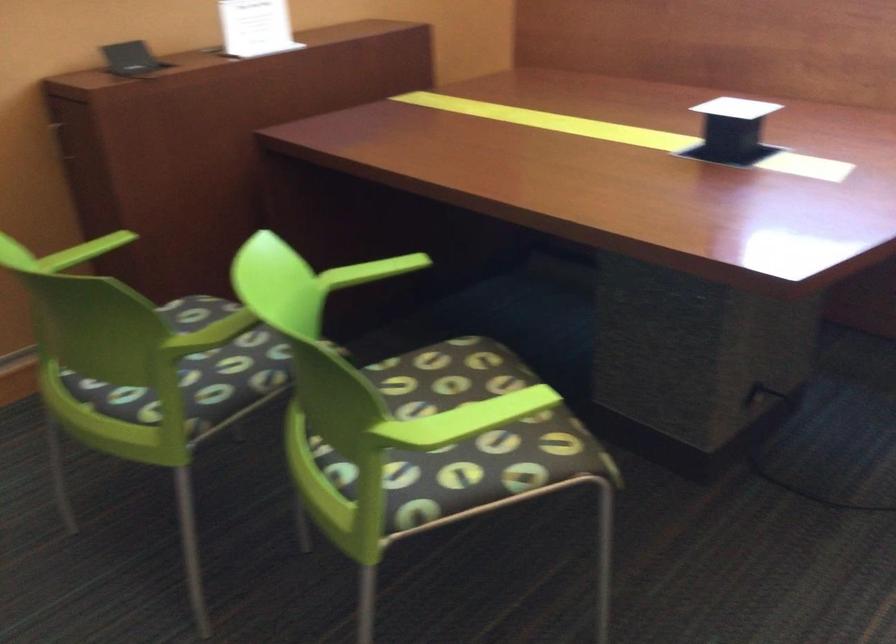
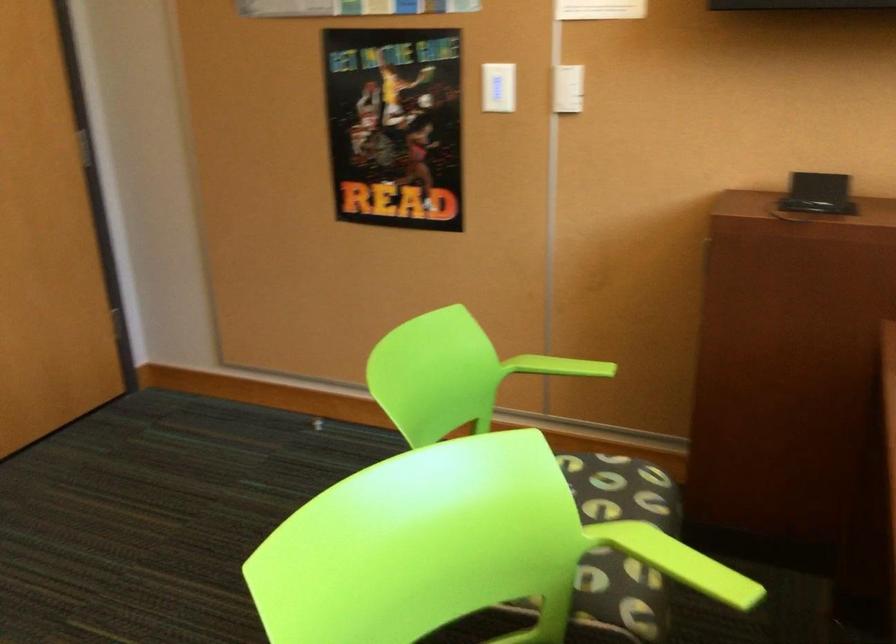
Question: I am providing you with two images of the same scene from different viewpoints. Please identify which objects are invisible in image2.

Choices:
 (A) small black device
 (B) green chair armrest
 (C) white light switch
 (D) none of these

Answer: (D)